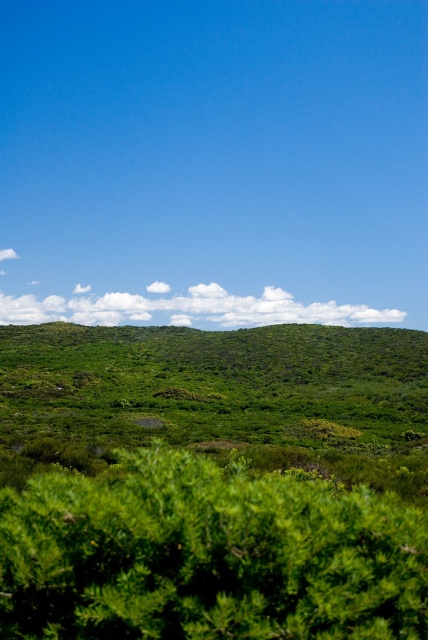
Is green leafy bush at center thinner than green leafy hillside at center?

Correct, green leafy bush at center's width is less than green leafy hillside at center's.

This screenshot has width=428, height=640. Describe the element at coordinates (208, 556) in the screenshot. I see `green leafy bush at center` at that location.

The height and width of the screenshot is (640, 428). Find the location of `green leafy bush at center`. green leafy bush at center is located at coordinates (208, 556).

Is green leafy bush at center to the right of white fluffy cloud at center from the viewer's perspective?

Correct, you'll find green leafy bush at center to the right of white fluffy cloud at center.

I want to click on green leafy bush at center, so click(x=208, y=556).

From the picture: Which of these two, green leafy hillside at center or white fluffy cloud at center, stands taller?

With more height is white fluffy cloud at center.

Is green leafy hillside at center above white fluffy cloud at center?

No, green leafy hillside at center is not above white fluffy cloud at center.

Locate an element on the screen. green leafy hillside at center is located at coordinates (213, 381).